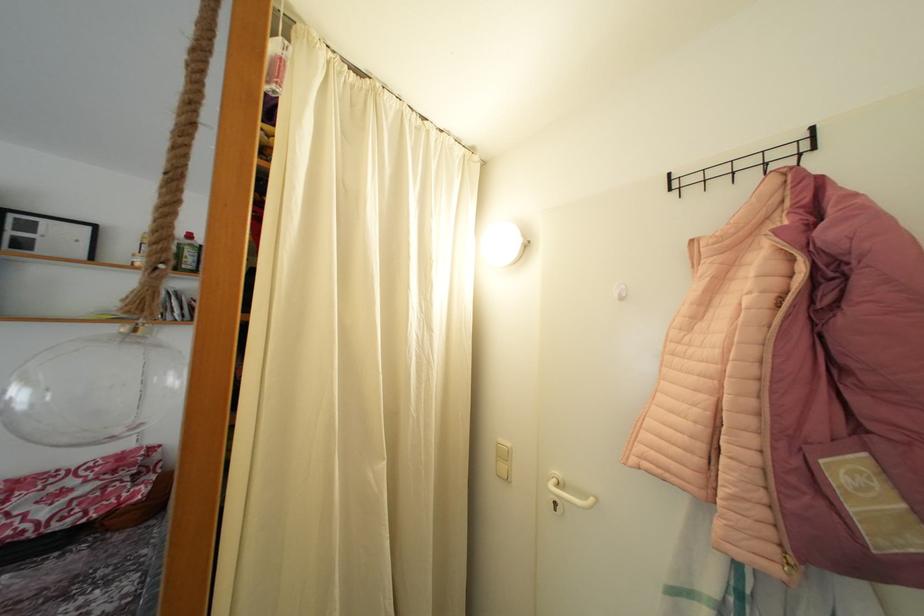
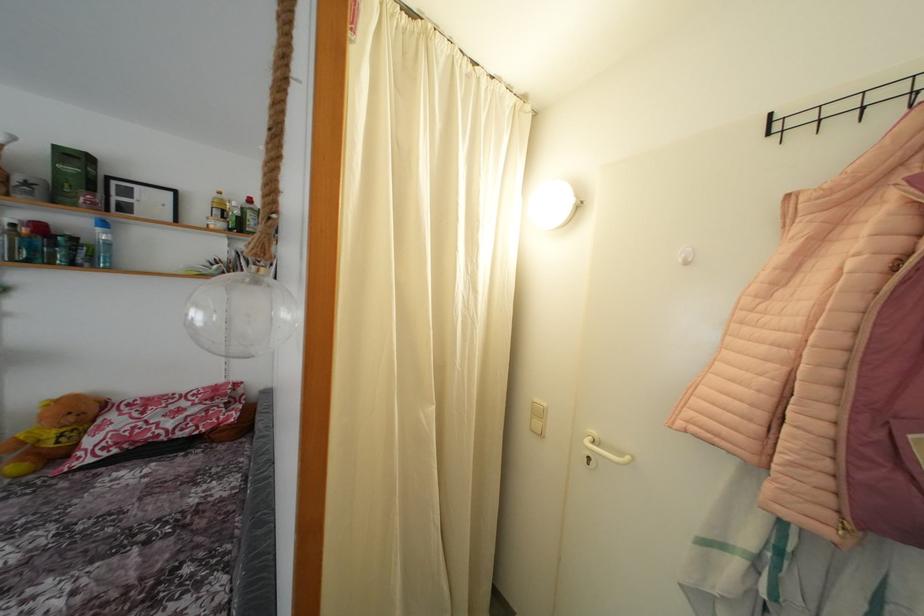
Question: The images are taken continuously from a first-person perspective. In which direction is your viewpoint rotating?

Choices:
 (A) Left
 (B) Right
 (C) Up
 (D) Down

Answer: (D)